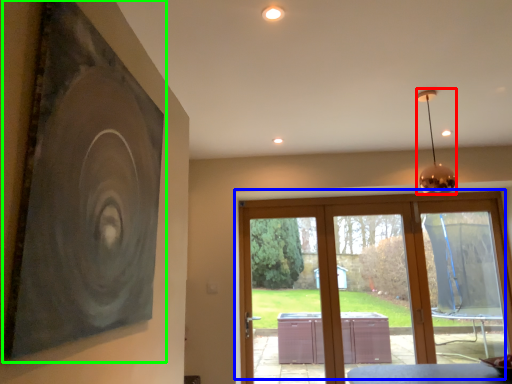
Question: Estimate the real-world distances between objects in this image. Which object is farther from lamp (highlighted by a red box), window (highlighted by a blue box) or picture frame (highlighted by a green box)?

Choices:
 (A) window
 (B) picture frame

Answer: (A)